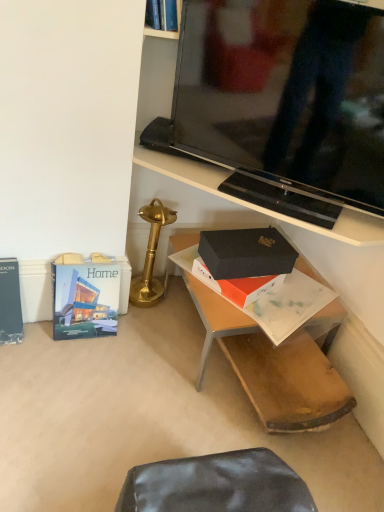
At what (x,y) coordinates should I click in order to perform the action: click on free space above black matte box at center (from a real-world perspective). Please return your answer as a coordinate pair (x, y). Image resolution: width=384 pixels, height=512 pixels. Looking at the image, I should click on (248, 239).